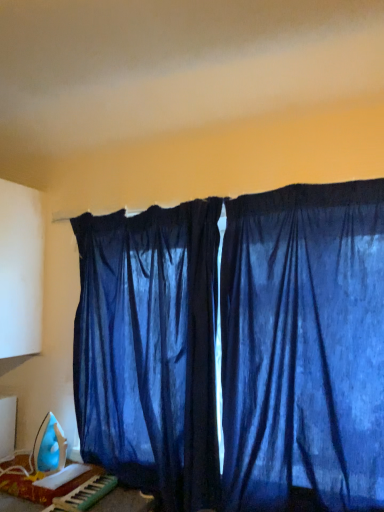
What do you see at coordinates (45, 485) in the screenshot? Image resolution: width=384 pixels, height=512 pixels. I see `blue plastic iron at lower left` at bounding box center [45, 485].

The image size is (384, 512). What do you see at coordinates (150, 350) in the screenshot?
I see `satin blue curtain at center, the second curtain when ordered from right to left` at bounding box center [150, 350].

Where is `blue plastic iron at lower left`? Image resolution: width=384 pixels, height=512 pixels. blue plastic iron at lower left is located at coordinates (45, 485).

Is plastic green and white musical keyboard at lower left wider or thinner than satin blue curtain at center, the second curtain when ordered from right to left?

plastic green and white musical keyboard at lower left is wider than satin blue curtain at center, the second curtain when ordered from right to left.

From the image's perspective, who appears lower, plastic green and white musical keyboard at lower left or satin blue curtain at center, the second curtain when ordered from right to left?

plastic green and white musical keyboard at lower left.

From a real-world perspective, is plastic green and white musical keyboard at lower left positioned under satin blue curtain at center, which is counted as the 1th curtain, starting from the left, based on gravity?

Yes, from a real-world perspective, plastic green and white musical keyboard at lower left is below satin blue curtain at center, which is counted as the 1th curtain, starting from the left.

Which is in front, point (85, 488) or point (173, 283)?

The point (85, 488) is closer.

Is blue sheer curtains at center, which is the 1th curtain in right-to-left order, facing towards blue plastic iron at lower left?

No.

From a real-world perspective, is blue sheer curtains at center, the second curtain viewed from the left, under blue plastic iron at lower left?

No, from a real-world perspective, blue sheer curtains at center, the second curtain viewed from the left, is not below blue plastic iron at lower left.

Are blue sheer curtains at center, which is the 1th curtain in right-to-left order, and blue plastic iron at lower left making contact?

No, blue sheer curtains at center, which is the 1th curtain in right-to-left order, is not making contact with blue plastic iron at lower left.

Does point (226, 418) lie behind point (53, 490)?

No.

Is point (150, 420) farther from viewer compared to point (44, 485)?

Yes, it is.

Is satin blue curtain at center, the second curtain when ordered from right to left, next to blue plastic iron at lower left?

No, satin blue curtain at center, the second curtain when ordered from right to left, is not with blue plastic iron at lower left.

Consider the image. Would you say satin blue curtain at center, which is counted as the 1th curtain, starting from the left, contains blue plastic iron at lower left?

No, blue plastic iron at lower left is not surrounded by satin blue curtain at center, which is counted as the 1th curtain, starting from the left.

Does satin blue curtain at center, the second curtain when ordered from right to left, lie in front of blue plastic iron at lower left?

Yes, it is.

What are the coordinates of `musical keyboard to the right of blue plastic iron at lower left` in the screenshot? It's located at (85, 494).

Between plastic green and white musical keyboard at lower left and blue plastic iron at lower left, which one has larger size?

blue plastic iron at lower left.

Can you see plastic green and white musical keyboard at lower left touching blue plastic iron at lower left?

They are not placed beside each other.

Based on the photo, can you confirm if plastic green and white musical keyboard at lower left is positioned to the right of blue plastic iron at lower left?

Indeed, plastic green and white musical keyboard at lower left is positioned on the right side of blue plastic iron at lower left.

In the scene shown: Are blue sheer curtains at center, which is the 1th curtain in right-to-left order, and satin blue curtain at center, the second curtain when ordered from right to left, far apart?

blue sheer curtains at center, which is the 1th curtain in right-to-left order, is near satin blue curtain at center, the second curtain when ordered from right to left, not far away.

From the image's perspective, which object appears higher, blue sheer curtains at center, the second curtain viewed from the left, or satin blue curtain at center, the second curtain when ordered from right to left?

blue sheer curtains at center, the second curtain viewed from the left, is shown above in the image.

Which object is thinner, blue sheer curtains at center, the second curtain viewed from the left, or satin blue curtain at center, the second curtain when ordered from right to left?

With smaller width is blue sheer curtains at center, the second curtain viewed from the left.

Which object is wider, blue sheer curtains at center, the second curtain viewed from the left, or plastic green and white musical keyboard at lower left?

Wider between the two is plastic green and white musical keyboard at lower left.

Does blue sheer curtains at center, which is the 1th curtain in right-to-left order, touch plastic green and white musical keyboard at lower left?

No, blue sheer curtains at center, which is the 1th curtain in right-to-left order, is not next to plastic green and white musical keyboard at lower left.

Looking at the image, does blue sheer curtains at center, which is the 1th curtain in right-to-left order, seem bigger or smaller compared to plastic green and white musical keyboard at lower left?

In the image, blue sheer curtains at center, which is the 1th curtain in right-to-left order, appears to be larger than plastic green and white musical keyboard at lower left.

Choose the correct answer: Is plastic green and white musical keyboard at lower left inside blue sheer curtains at center, which is the 1th curtain in right-to-left order, or outside it?

plastic green and white musical keyboard at lower left is outside blue sheer curtains at center, which is the 1th curtain in right-to-left order.

Is there a large distance between plastic green and white musical keyboard at lower left and blue sheer curtains at center, the second curtain viewed from the left?

No, plastic green and white musical keyboard at lower left is in close proximity to blue sheer curtains at center, the second curtain viewed from the left.

From a real-world perspective, is plastic green and white musical keyboard at lower left located beneath blue sheer curtains at center, which is the 1th curtain in right-to-left order?

Yes, from a real-world perspective, plastic green and white musical keyboard at lower left is below blue sheer curtains at center, which is the 1th curtain in right-to-left order.

Which is in front, point (82, 509) or point (159, 328)?

The point (82, 509) is closer to the camera.

Where is `curtain that is the 1st one when counting rightward from the plastic green and white musical keyboard at lower left`? curtain that is the 1st one when counting rightward from the plastic green and white musical keyboard at lower left is located at coordinates (150, 350).

Identify the location of furniture below the blue sheer curtains at center, the second curtain viewed from the left (from a real-world perspective). (45, 485).

Which object lies nearer to the anchor point blue plastic iron at lower left, blue sheer curtains at center, the second curtain viewed from the left, or plastic green and white musical keyboard at lower left?

plastic green and white musical keyboard at lower left.

Based on their spatial positions, is plastic green and white musical keyboard at lower left or blue sheer curtains at center, the second curtain viewed from the left, further from satin blue curtain at center, which is counted as the 1th curtain, starting from the left?

plastic green and white musical keyboard at lower left is positioned further to the anchor satin blue curtain at center, which is counted as the 1th curtain, starting from the left.

Estimate the real-world distances between objects in this image. Which object is further from blue plastic iron at lower left, plastic green and white musical keyboard at lower left or satin blue curtain at center, the second curtain when ordered from right to left?

satin blue curtain at center, the second curtain when ordered from right to left.

Looking at the image, which one is located closer to blue plastic iron at lower left, plastic green and white musical keyboard at lower left or blue sheer curtains at center, which is the 1th curtain in right-to-left order?

plastic green and white musical keyboard at lower left lies closer to blue plastic iron at lower left than the other object.

Looking at the image, which one is located further to plastic green and white musical keyboard at lower left, blue plastic iron at lower left or blue sheer curtains at center, the second curtain viewed from the left?

The object further to plastic green and white musical keyboard at lower left is blue sheer curtains at center, the second curtain viewed from the left.

Consider the image. From the image, which object appears to be farther from satin blue curtain at center, the second curtain when ordered from right to left, blue sheer curtains at center, which is the 1th curtain in right-to-left order, or plastic green and white musical keyboard at lower left?

The object further to satin blue curtain at center, the second curtain when ordered from right to left, is plastic green and white musical keyboard at lower left.

When comparing their distances from blue sheer curtains at center, which is the 1th curtain in right-to-left order, does plastic green and white musical keyboard at lower left or satin blue curtain at center, the second curtain when ordered from right to left, seem further?

The object further to blue sheer curtains at center, which is the 1th curtain in right-to-left order, is plastic green and white musical keyboard at lower left.

Which object lies further to the anchor point blue plastic iron at lower left, satin blue curtain at center, the second curtain when ordered from right to left, or blue sheer curtains at center, which is the 1th curtain in right-to-left order?

blue sheer curtains at center, which is the 1th curtain in right-to-left order, is positioned further to the anchor blue plastic iron at lower left.

What are the coordinates of `curtain between blue plastic iron at lower left and blue sheer curtains at center, the second curtain viewed from the left` in the screenshot? It's located at (150, 350).

Where is `musical keyboard located between blue plastic iron at lower left and blue sheer curtains at center, the second curtain viewed from the left, in the left-right direction`? This screenshot has height=512, width=384. musical keyboard located between blue plastic iron at lower left and blue sheer curtains at center, the second curtain viewed from the left, in the left-right direction is located at coordinates (85, 494).

Image resolution: width=384 pixels, height=512 pixels. What are the coordinates of `curtain between blue sheer curtains at center, the second curtain viewed from the left, and plastic green and white musical keyboard at lower left vertically` in the screenshot? It's located at (150, 350).

Identify the location of musical keyboard between satin blue curtain at center, the second curtain when ordered from right to left, and blue plastic iron at lower left, in the vertical direction. This screenshot has height=512, width=384. (85, 494).